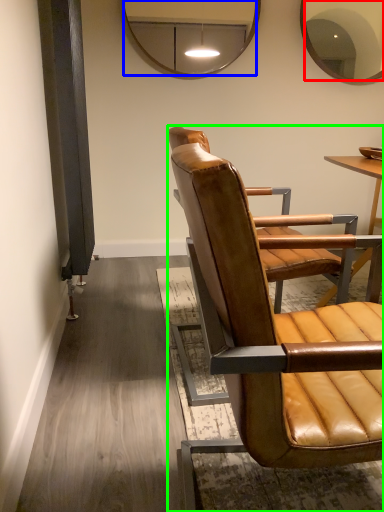
Question: Based on their relative distances, which object is nearer to mirror (highlighted by a red box)? Choose from mirror (highlighted by a blue box) and chair (highlighted by a green box).

Choices:
 (A) mirror
 (B) chair

Answer: (A)